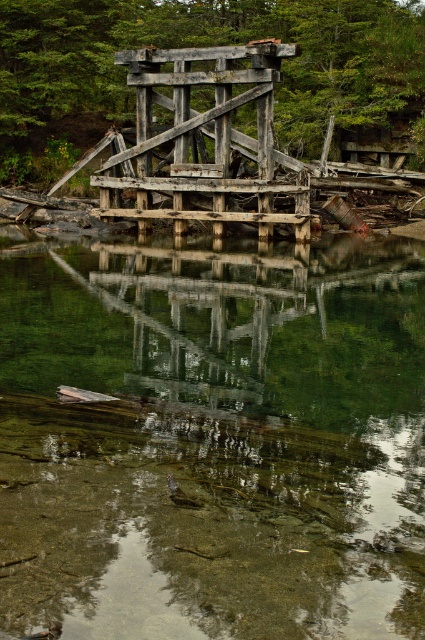
Which of these two, clear glass water at center or wooden bridge at center, stands shorter?

wooden bridge at center

In order to click on clear glass water at center in this screenshot , I will do `click(212, 440)`.

Is weathered wood bridge at center below wooden bridge at center?

Actually, weathered wood bridge at center is above wooden bridge at center.

Is weathered wood bridge at center shorter than wooden bridge at center?

In fact, weathered wood bridge at center may be taller than wooden bridge at center.

What do you see at coordinates (207, 134) in the screenshot?
I see `weathered wood bridge at center` at bounding box center [207, 134].

Where is `weathered wood bridge at center`? This screenshot has height=640, width=425. weathered wood bridge at center is located at coordinates (207, 134).

Is rusty wooden bridge at center above wooden bridge at center?

Yes, rusty wooden bridge at center is above wooden bridge at center.

Is rusty wooden bridge at center below wooden bridge at center?

No, rusty wooden bridge at center is not below wooden bridge at center.

Describe the element at coordinates (206, 44) in the screenshot. Image resolution: width=425 pixels, height=640 pixels. I see `rusty wooden bridge at center` at that location.

Where is `rusty wooden bridge at center`? The width and height of the screenshot is (425, 640). rusty wooden bridge at center is located at coordinates (206, 44).